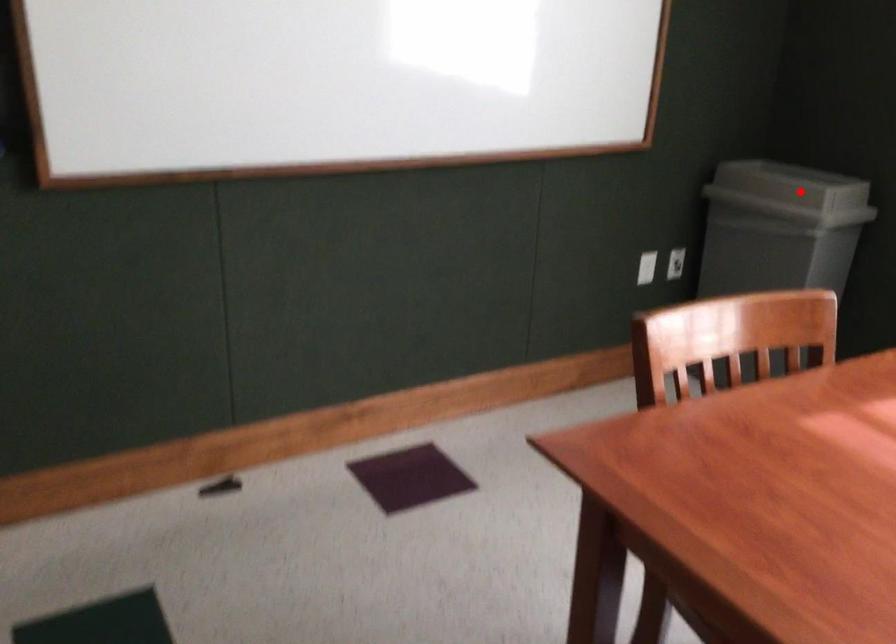
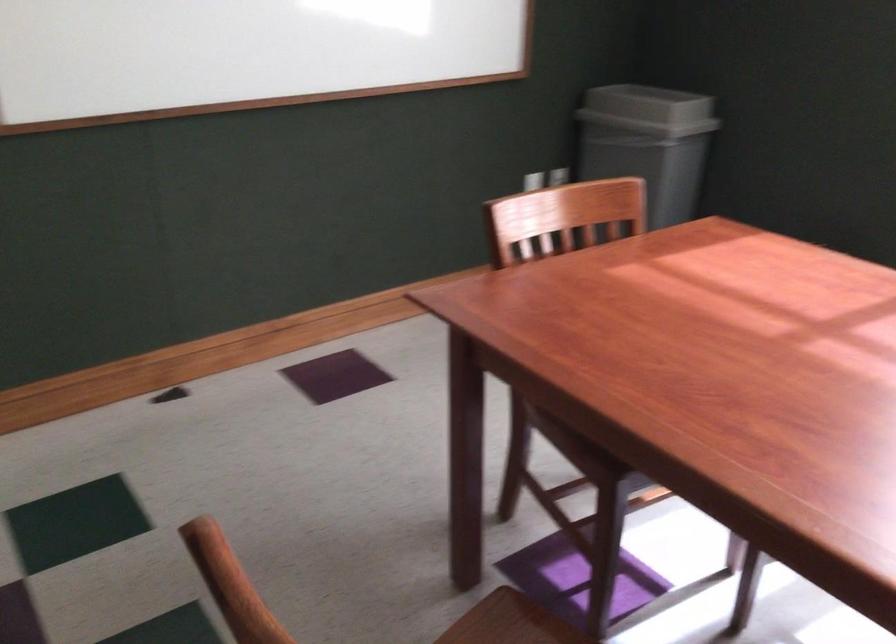
Question: I am providing you with two images of the same scene from different viewpoints. In image1, a red point is highlighted. Considering the same 3D point in image2, which of the following is correct?

Choices:
 (A) It is closer
 (B) It is farther

Answer: (B)